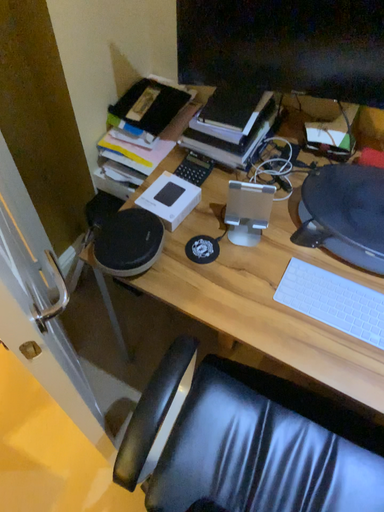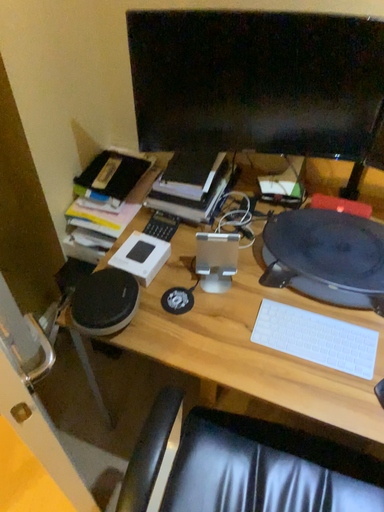
Question: How did the camera likely rotate when shooting the video?

Choices:
 (A) rotated downward
 (B) rotated upward

Answer: (B)